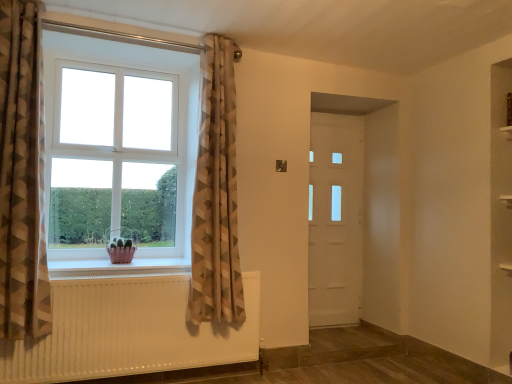
Question: Looking at the image, does white plastic window at left seem bigger or smaller compared to neutral geometric fabric curtain at upper left, which ranks as the second curtain in left-to-right order?

Choices:
 (A) big
 (B) small

Answer: (B)

Question: Does point (53, 248) appear closer or farther from the camera than point (210, 140)?

Choices:
 (A) farther
 (B) closer

Answer: (B)

Question: Considering the real-world distances, which object is farthest from the white matte door at center?

Choices:
 (A) neutral geometric fabric curtain at upper left, the first curtain positioned from the back
 (B) pink plastic basket at lower left
 (C) white textured radiator at lower left
 (D) brown geometric fabric curtain at left, which is the 2th curtain from back to front
 (E) white plastic window at left

Answer: (D)

Question: Which object is positioned farthest from the brown geometric fabric curtain at left, arranged as the 1th curtain when viewed from the front?

Choices:
 (A) neutral geometric fabric curtain at upper left, which ranks as the second curtain in left-to-right order
 (B) pink plastic basket at lower left
 (C) white textured radiator at lower left
 (D) white matte door at center
 (E) white plastic window at left

Answer: (D)